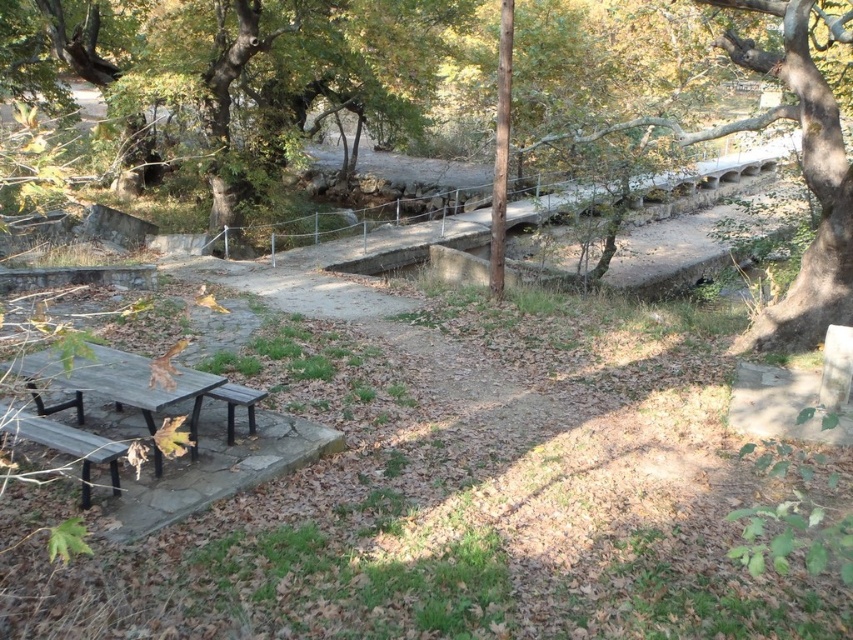
Can you confirm if smooth bark tree at upper right is wider than wooden picnic table at lower left?

No.

Is smooth bark tree at upper right positioned in front of wooden picnic table at lower left?

No.

Does point (833, 218) come behind point (76, 404)?

Yes, point (833, 218) is farther from viewer.

Image resolution: width=853 pixels, height=640 pixels. I want to click on smooth bark tree at upper right, so click(x=799, y=164).

Is green leafy tree at upper left above wooden picnic table at lower left?

Yes, green leafy tree at upper left is above wooden picnic table at lower left.

Is green leafy tree at upper left taller than wooden picnic table at lower left?

Indeed, green leafy tree at upper left has a greater height compared to wooden picnic table at lower left.

Find the location of `green leafy tree at upper left`. green leafy tree at upper left is located at coordinates (236, 74).

Does smooth bark tree at upper right have a greater height compared to wooden park bench at lower left?

No.

Which is below, smooth bark tree at upper right or wooden park bench at lower left?

Positioned lower is wooden park bench at lower left.

Which is in front, point (808, 49) or point (94, 442)?

Point (94, 442) is more forward.

This screenshot has width=853, height=640. I want to click on smooth bark tree at upper right, so click(x=799, y=164).